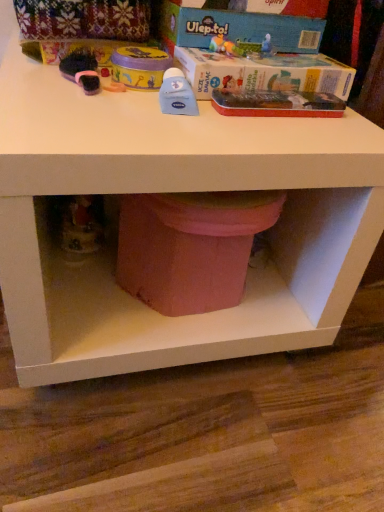
Question: Is blue cardboard box at upper center, which ranks as the 2th box in bottom-to-top order, positioned with its back to matte pink potty at lower center?

Choices:
 (A) yes
 (B) no

Answer: (B)

Question: Can you confirm if blue cardboard box at upper center, which ranks as the 1th box in top-to-bottom order, is smaller than matte pink potty at lower center?

Choices:
 (A) no
 (B) yes

Answer: (B)

Question: Is blue cardboard box at upper center, which ranks as the 1th box in top-to-bottom order, oriented towards matte pink potty at lower center?

Choices:
 (A) yes
 (B) no

Answer: (B)

Question: From a real-world perspective, does blue cardboard box at upper center, which ranks as the 2th box in bottom-to-top order, sit lower than matte pink potty at lower center?

Choices:
 (A) yes
 (B) no

Answer: (B)

Question: Can you confirm if blue cardboard box at upper center, which ranks as the 2th box in bottom-to-top order, is positioned to the right of matte pink potty at lower center?

Choices:
 (A) no
 (B) yes

Answer: (B)

Question: Is blue cardboard box at upper center, acting as the first box starting from the bottom, inside the boundaries of blue cardboard box at upper center, which ranks as the 1th box in top-to-bottom order, or outside?

Choices:
 (A) outside
 (B) inside

Answer: (A)

Question: Is blue cardboard box at upper center, the 2th box viewed from the top, wider or thinner than blue cardboard box at upper center, which ranks as the 2th box in bottom-to-top order?

Choices:
 (A) thin
 (B) wide

Answer: (B)

Question: In terms of size, does blue cardboard box at upper center, acting as the first box starting from the bottom, appear bigger or smaller than blue cardboard box at upper center, which ranks as the 1th box in top-to-bottom order?

Choices:
 (A) big
 (B) small

Answer: (A)

Question: In the image, is blue cardboard box at upper center, acting as the first box starting from the bottom, on the left side or the right side of blue cardboard box at upper center, which ranks as the 1th box in top-to-bottom order?

Choices:
 (A) right
 (B) left

Answer: (A)

Question: Considering the relative positions of blue cardboard box at upper center, which ranks as the 2th box in bottom-to-top order, and matte pink potty at lower center in the image provided, is blue cardboard box at upper center, which ranks as the 2th box in bottom-to-top order, to the left or to the right of matte pink potty at lower center?

Choices:
 (A) left
 (B) right

Answer: (B)

Question: Is blue cardboard box at upper center, which ranks as the 1th box in top-to-bottom order, inside the boundaries of matte pink potty at lower center, or outside?

Choices:
 (A) outside
 (B) inside

Answer: (A)

Question: Is point (294, 44) positioned closer to the camera than point (195, 244)?

Choices:
 (A) farther
 (B) closer

Answer: (A)

Question: From a real-world perspective, is blue cardboard box at upper center, which ranks as the 1th box in top-to-bottom order, positioned above or below matte pink potty at lower center?

Choices:
 (A) above
 (B) below

Answer: (A)

Question: In terms of height, does blue cardboard box at upper center, which ranks as the 2th box in bottom-to-top order, look taller or shorter compared to blue cardboard box at upper center, the 2th box viewed from the top?

Choices:
 (A) short
 (B) tall

Answer: (A)

Question: Visually, is blue cardboard box at upper center, which ranks as the 2th box in bottom-to-top order, positioned to the left or to the right of blue cardboard box at upper center, the 2th box viewed from the top?

Choices:
 (A) right
 (B) left

Answer: (B)